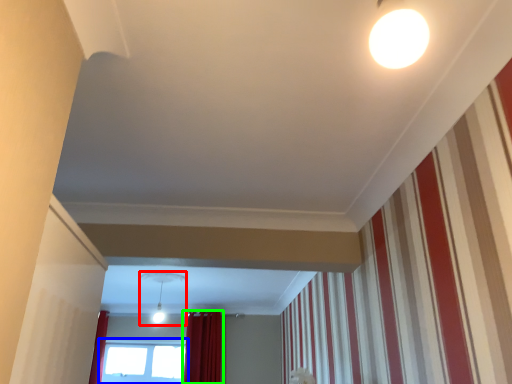
Question: Estimate the real-world distances between objects in this image. Which object is farther from light fixture (highlighted by a red box), window (highlighted by a blue box) or curtain (highlighted by a green box)?

Choices:
 (A) window
 (B) curtain

Answer: (A)